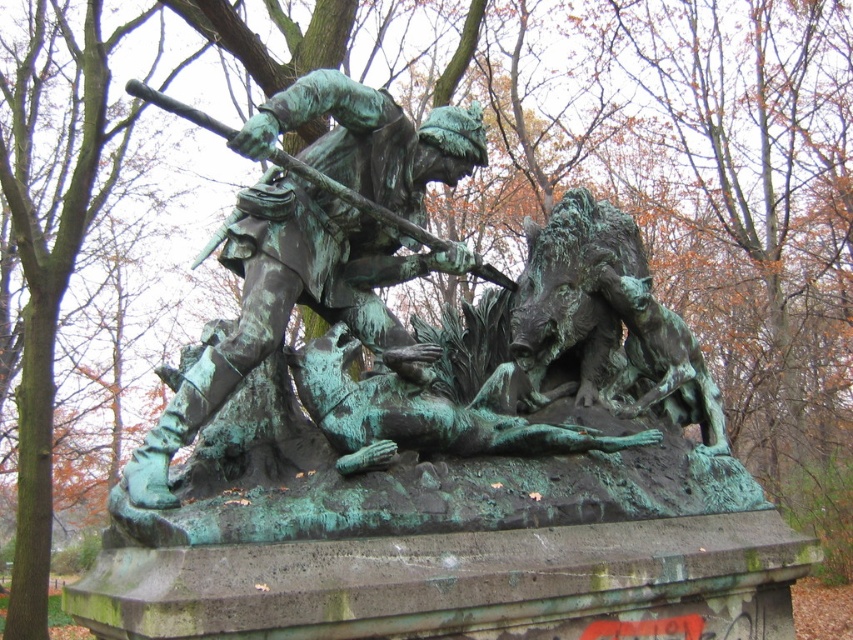
From the picture: You are a park visitor standing in front of the green patina statue at center and the green patina bronze boar at center. Which object is positioned higher in the scene?

The green patina statue at center is positioned higher than the green patina bronze boar at center according to the description.

You are a park visitor who wants to take a photo of the green patina statue at center and the green patina bronze boar at center. Since you have a camera with a fixed focal length, you need to adjust your distance to ensure both subjects are in frame. Which subject should you move closer to and which should you move further away from to capture both in the same shot?

Since the green patina statue at center is larger than the green patina bronze boar at center, you should move closer to the green patina bronze boar at center and further away from the green patina statue at center to balance their sizes in the photo.

You are an art student standing at the origin point of a coordinate system placed at the bottom left corner of the image. You want to sketch the green patina statue at center. What are the coordinates of the statue?

The coordinates of the green patina statue at center are at point (317,241).